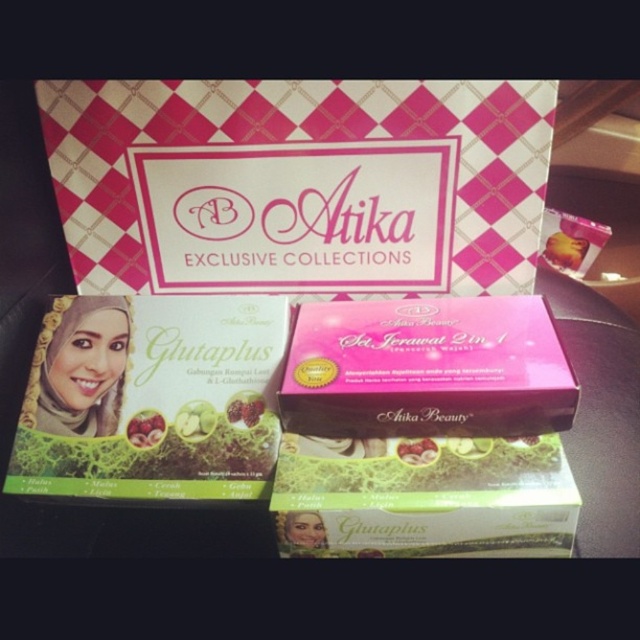
You are a customer at the Atika store and want to pick up the green matte glutaplus box at lower left and the pink matte box at upper center. Which box should you reach for first to grab both efficiently?

You should reach for the green matte glutaplus box at lower left first since it is closer to you than the pink matte box at upper center, allowing you to grab both efficiently.

You are a customer looking at the Atika beauty products display. You see the green matte glutaplus box at lower left and the pink matte box at upper center. Which box is located above the other?

The pink matte box at upper center is above the green matte glutaplus box at lower left.